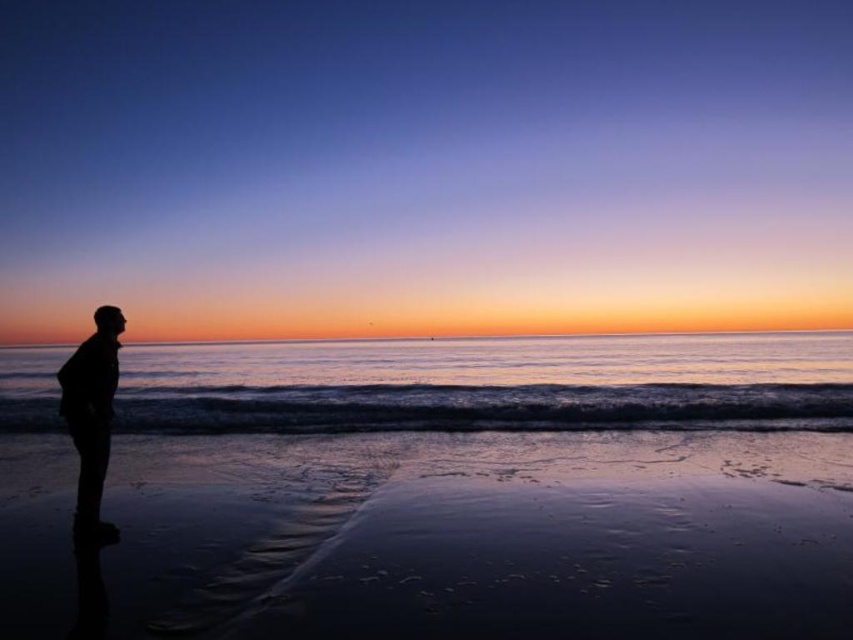
You are a photographer wanting to capture the silhouette figure at left and the shiny wet sand at lower center in the same frame. Which object is closer to the camera based on their relative heights?

The silhouette figure at left is closer to the camera because it has a greater height than the shiny wet sand at lower center.